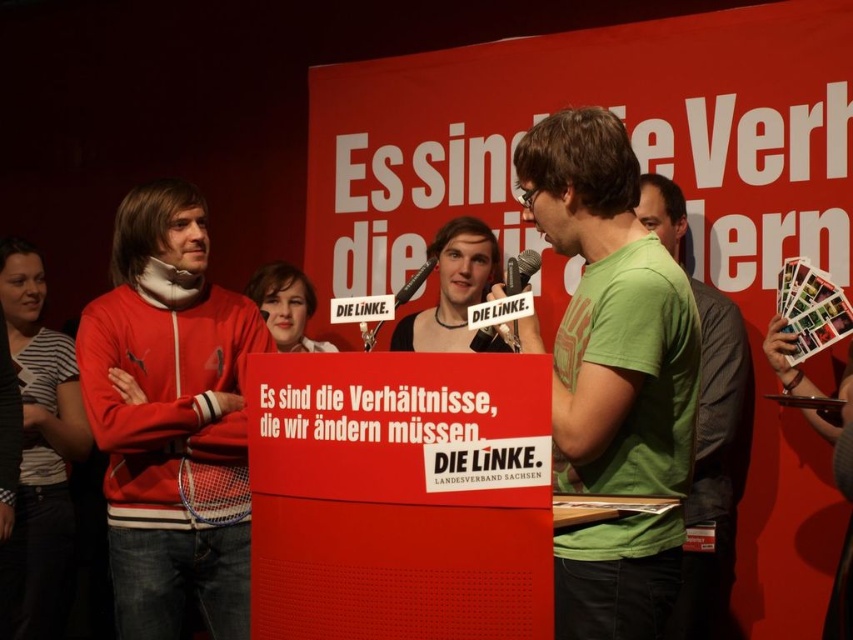
Question: Estimate the real-world distances between objects in this image. Which object is farther from the green matte t-shirt at center?

Choices:
 (A) black metallic microphone at center
 (B) green matte t-shirt at right
 (C) metallic silver microphone at center
 (D) matte red sweatshirt at left

Answer: (D)

Question: Considering the relative positions of matte red sweatshirt at left and striped fabric shirt at left in the image provided, where is matte red sweatshirt at left located with respect to striped fabric shirt at left?

Choices:
 (A) below
 (B) above

Answer: (B)

Question: Which point is farther to the camera?

Choices:
 (A) smooth skin face at center
 (B) striped fabric shirt at left
 (C) metallic silver microphone at center

Answer: (A)

Question: Observing the image, what is the correct spatial positioning of metallic silver microphone at center in reference to black metallic microphone at center?

Choices:
 (A) left
 (B) right

Answer: (B)

Question: Which object is positioned farthest from the black metallic microphone at center?

Choices:
 (A) matte red sweatshirt at left
 (B) smooth skin face at center
 (C) green matte t-shirt at center

Answer: (B)

Question: Does striped fabric shirt at left have a lesser width compared to smooth skin face at center?

Choices:
 (A) no
 (B) yes

Answer: (A)